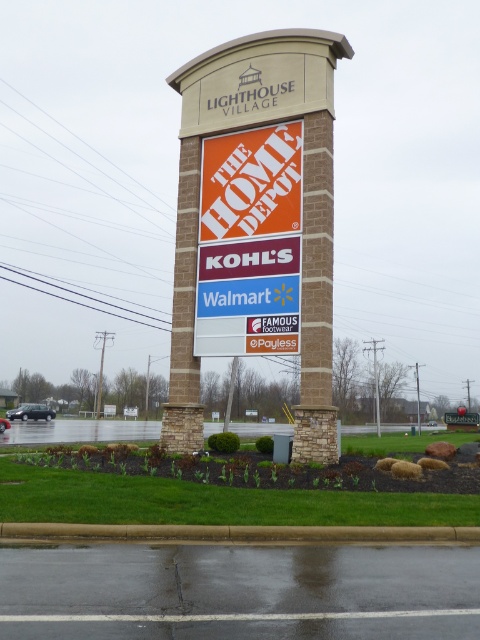
You are a maintenance worker checking the height of the signage and pole at the shopping center entrance. Which object is shorter between the orangematerialsignage at center and the metallic pole at center?

The orangematerialsignage at center is shorter than the metallic pole at center.

You are a delivery person trying to park your vehicle near the shopping center entrance. You see the black matte car at lower left and the metallic pole at center. Which object is positioned higher up in the image?

The black matte car at lower left is located above the metallic pole at center, so it is positioned higher up in the image.